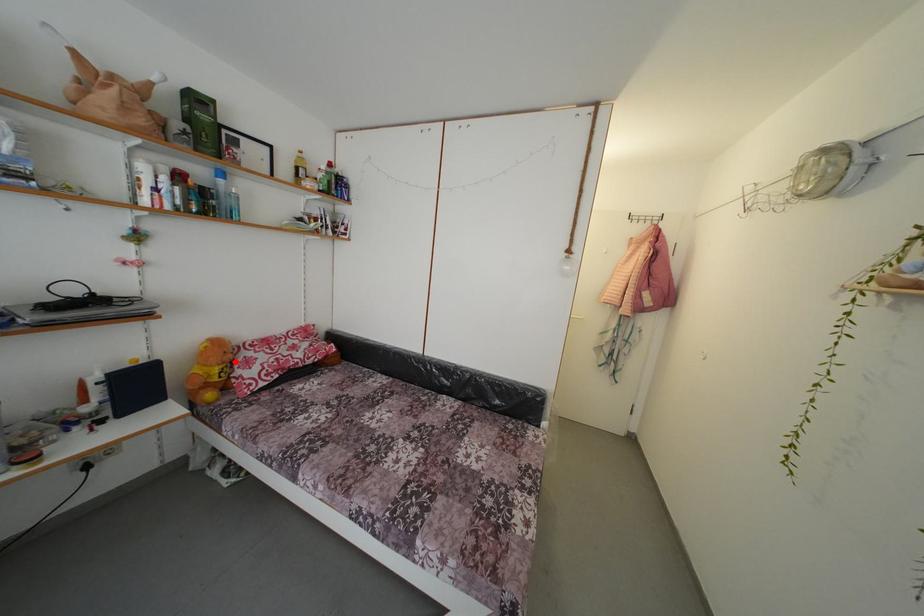
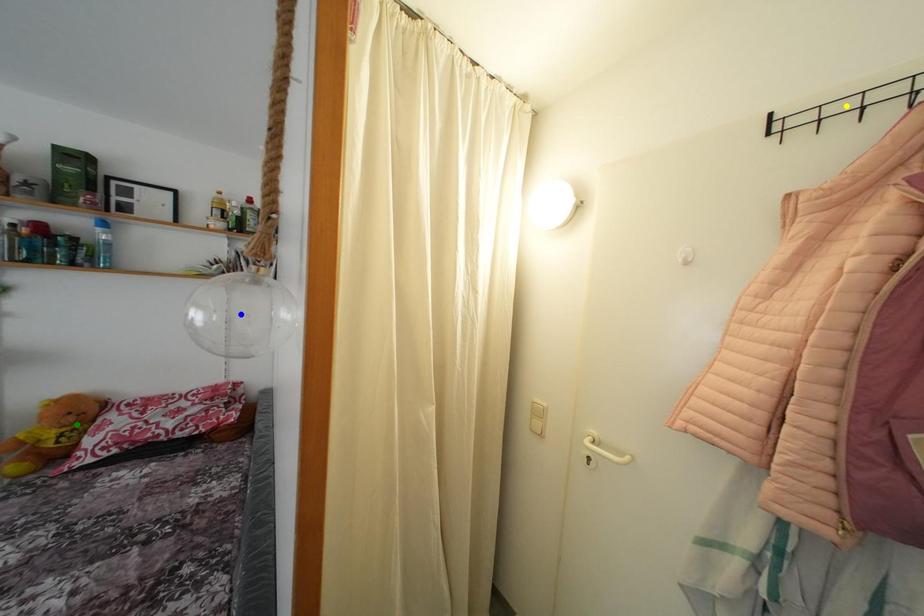
Question: I am providing you with two images of the same scene from different viewpoints. A red point is marked on the first image. You are given multiple points on the second image. Which point in image 2 represents the same 3d spot as the red point in image 1?

Choices:
 (A) yellow point
 (B) green point
 (C) blue point

Answer: (B)